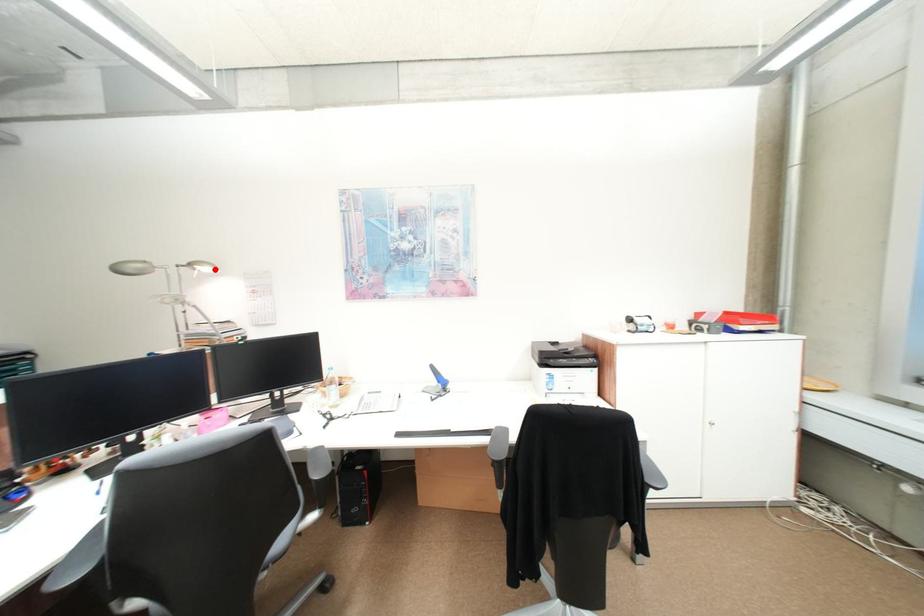
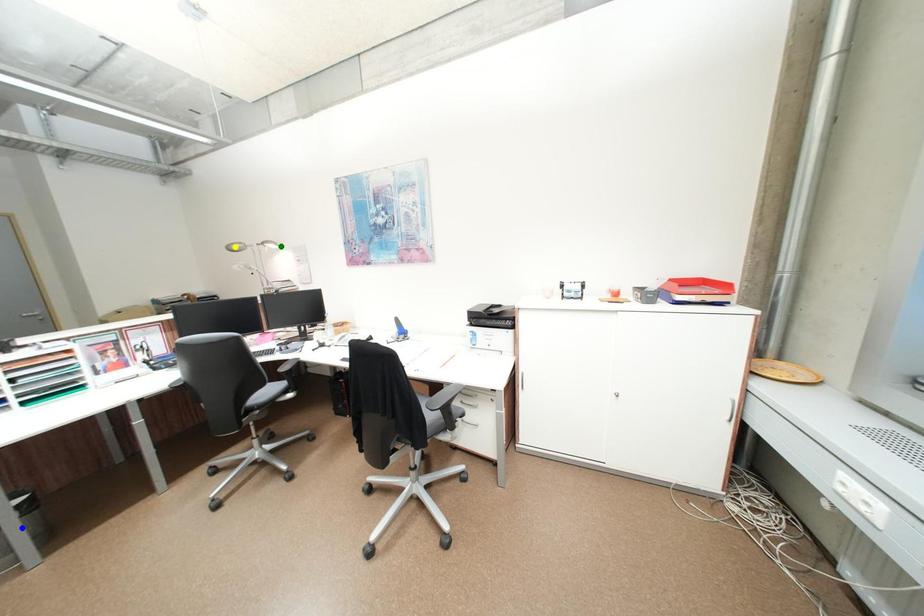
Question: I am providing you with two images of the same scene from different viewpoints. A red point is marked on the first image. You are given multiple points on the second image. Which point in image 2 is actually the same real-world point as the red point in image 1?

Choices:
 (A) green point
 (B) yellow point
 (C) blue point

Answer: (A)